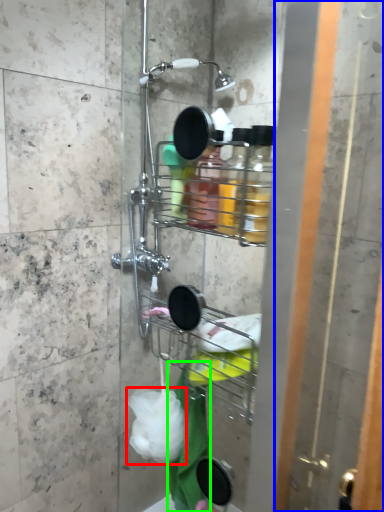
Question: Estimate the real-world distances between objects in this image. Which object is farther from plastic (highlighted by a red box), screen door (highlighted by a blue box) or bath towel (highlighted by a green box)?

Choices:
 (A) screen door
 (B) bath towel

Answer: (A)